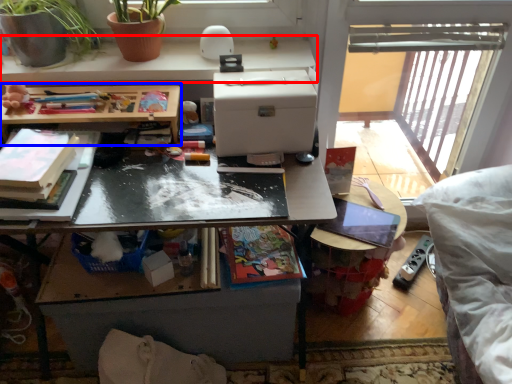
Question: Which object is further to the camera taking this photo, desk (highlighted by a red box) or table (highlighted by a blue box)?

Choices:
 (A) desk
 (B) table

Answer: (A)